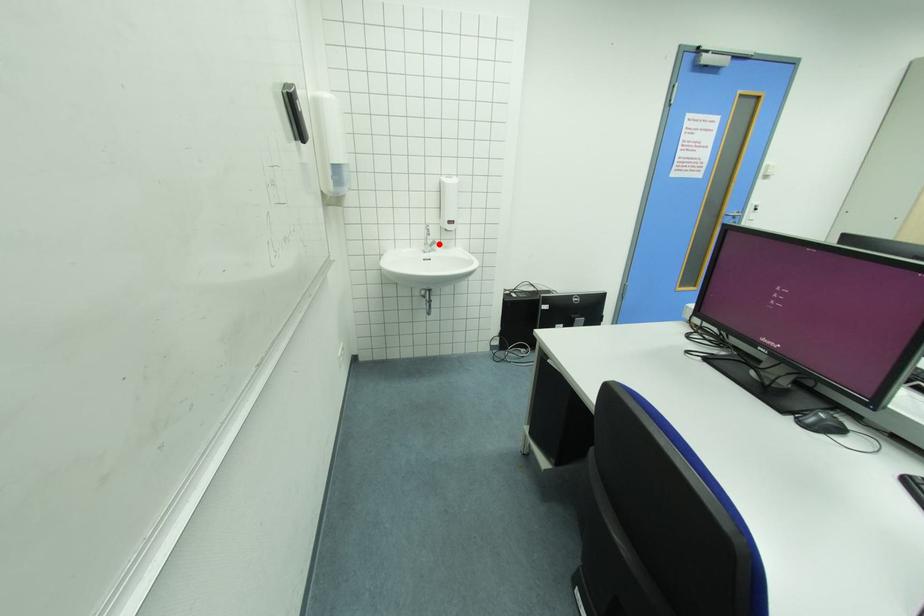
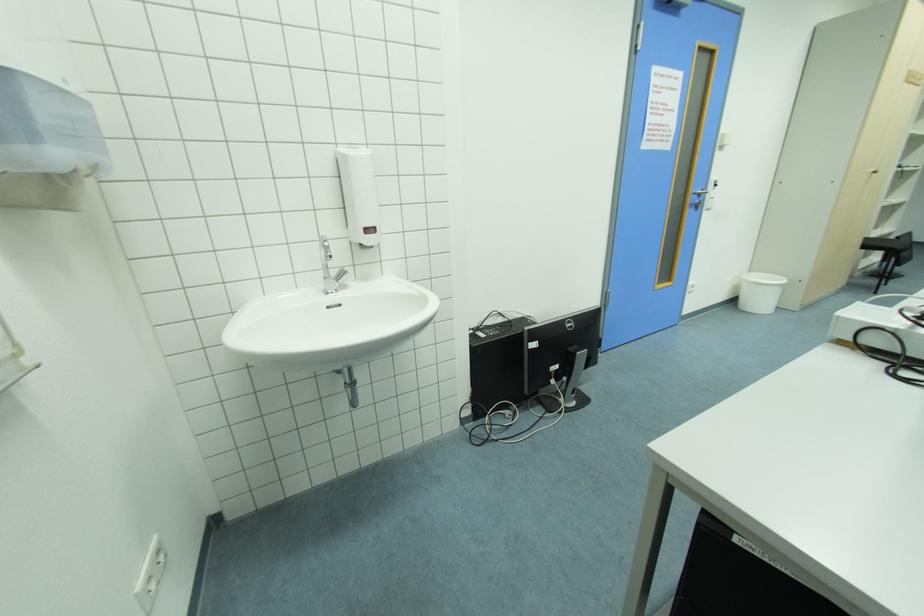
Where in the second image is the point corresponding to the highlighted location from the first image?

(347, 274)